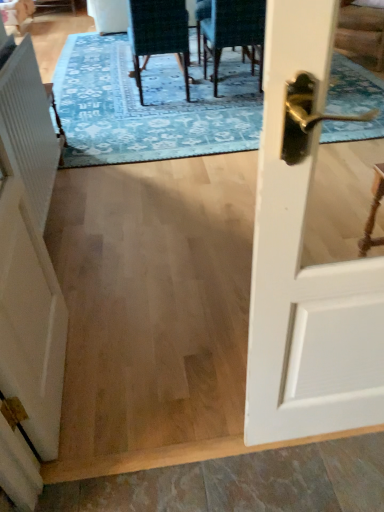
In order to click on velvet dark green chair at center, the 2th chair viewed from the right in this screenshot , I will do `click(159, 34)`.

Measure the distance between blue textured rug at center and camera.

8.70 feet.

This screenshot has width=384, height=512. Identify the location of velvet dark green chair at center, the 2th chair viewed from the right. (159, 34).

Can you tell me how much white ribbed radiator at left and velvet dark green chair at upper center, the 1th chair from the right, differ in facing direction?

The angular difference between white ribbed radiator at left and velvet dark green chair at upper center, the 1th chair from the right, is 87.5 degrees.

Between point (41, 215) and point (216, 82), which one is positioned in front?

The point (41, 215) is in front.

Do you think white ribbed radiator at left is within velvet dark green chair at upper center, the 2th chair when ordered from left to right, or outside of it?

The correct answer is: outside.

From a real-world perspective, between white ribbed radiator at left and velvet dark green chair at upper center, the 2th chair when ordered from left to right, who is vertically lower?

velvet dark green chair at upper center, the 2th chair when ordered from left to right, from a real-world perspective.

Is white ribbed radiator at left to the left or to the right of velvet dark green chair at center, marked as the first chair in a left-to-right arrangement, in the image?

From the image, it's evident that white ribbed radiator at left is to the left of velvet dark green chair at center, marked as the first chair in a left-to-right arrangement.

Which is in front, white ribbed radiator at left or velvet dark green chair at center, marked as the first chair in a left-to-right arrangement?

Positioned in front is white ribbed radiator at left.

From the image's perspective, which one is positioned higher, white ribbed radiator at left or velvet dark green chair at center, marked as the first chair in a left-to-right arrangement?

velvet dark green chair at center, marked as the first chair in a left-to-right arrangement, appears higher in the image.

Considering the relative sizes of blue textured rug at center and white matte barn door at left in the image provided, is blue textured rug at center shorter than white matte barn door at left?

Yes.

In terms of width, does blue textured rug at center look wider or thinner when compared to white matte barn door at left?

Clearly, blue textured rug at center has more width compared to white matte barn door at left.

Is blue textured rug at center bigger or smaller than white matte barn door at left?

Considering their sizes, blue textured rug at center takes up more space than white matte barn door at left.

Image resolution: width=384 pixels, height=512 pixels. In order to click on barn door that is above the blue textured rug at center (from a real-world perspective) in this screenshot , I will do `click(28, 282)`.

Considering the positions of point (25, 146) and point (167, 25), is point (25, 146) closer or farther from the camera than point (167, 25)?

Point (25, 146).

From the picture: Could you tell me if white matte barn door at left is turned towards velvet dark green chair at center, the 2th chair viewed from the right?

No, white matte barn door at left is not aimed at velvet dark green chair at center, the 2th chair viewed from the right.

Is white matte barn door at left beside velvet dark green chair at center, the 2th chair viewed from the right?

white matte barn door at left and velvet dark green chair at center, the 2th chair viewed from the right, are not in contact.

Does white matte barn door at left have a greater width compared to velvet dark green chair at center, marked as the first chair in a left-to-right arrangement?

No.

Can you confirm if white glossy door handle at right is wider than velvet dark green chair at upper center, the 2th chair when ordered from left to right?

No, white glossy door handle at right is not wider than velvet dark green chair at upper center, the 2th chair when ordered from left to right.

Is point (322, 73) positioned before point (253, 63)?

That is True.

Considering the sizes of objects white glossy door handle at right and velvet dark green chair at upper center, the 1th chair from the right, in the image provided, who is shorter, white glossy door handle at right or velvet dark green chair at upper center, the 1th chair from the right,?

With less height is velvet dark green chair at upper center, the 1th chair from the right.

Which is behind, white glossy door handle at right or velvet dark green chair at upper center, the 1th chair from the right?

velvet dark green chair at upper center, the 1th chair from the right.

Measure the distance between velvet dark green chair at center, marked as the first chair in a left-to-right arrangement, and white ribbed radiator at left.

A distance of 4.14 feet exists between velvet dark green chair at center, marked as the first chair in a left-to-right arrangement, and white ribbed radiator at left.

Is velvet dark green chair at center, the 2th chair viewed from the right, touching white ribbed radiator at left?

velvet dark green chair at center, the 2th chair viewed from the right, and white ribbed radiator at left are clearly separated.

I want to click on the 1st chair above the white ribbed radiator at left (from the image's perspective), so click(x=159, y=34).

Is the depth of velvet dark green chair at center, the 2th chair viewed from the right, less than that of white ribbed radiator at left?

No, it is not.

How many degrees apart are the facing directions of velvet dark green chair at upper center, the 1th chair from the right, and white matte barn door at left?

83.5 degrees.

From a real-world perspective, relative to white matte barn door at left, is velvet dark green chair at upper center, the 1th chair from the right, vertically above or below?

Clearly, from a real-world perspective, velvet dark green chair at upper center, the 1th chair from the right, is below white matte barn door at left.

Is velvet dark green chair at upper center, the 1th chair from the right, positioned far away from white matte barn door at left?

Yes, velvet dark green chair at upper center, the 1th chair from the right, is far from white matte barn door at left.

Does velvet dark green chair at upper center, the 2th chair when ordered from left to right, have a greater height compared to white matte barn door at left?

No.

The width and height of the screenshot is (384, 512). In order to click on radiator in front of the velvet dark green chair at upper center, the 2th chair when ordered from left to right in this screenshot , I will do `click(30, 128)`.

Locate an element on the screen. The image size is (384, 512). radiator below the velvet dark green chair at center, the 2th chair viewed from the right (from the image's perspective) is located at coordinates (30, 128).

Estimate the real-world distances between objects in this image. Which object is further from white ribbed radiator at left, velvet dark green chair at upper center, the 2th chair when ordered from left to right, or white matte barn door at left?

Among the two, velvet dark green chair at upper center, the 2th chair when ordered from left to right, is located further to white ribbed radiator at left.

Looking at the image, which one is located further to white matte barn door at left, velvet dark green chair at center, the 2th chair viewed from the right, or white ribbed radiator at left?

Based on the image, velvet dark green chair at center, the 2th chair viewed from the right, appears to be further to white matte barn door at left.

When comparing their distances from white glossy door handle at right, does white ribbed radiator at left or white matte barn door at left seem closer?

white matte barn door at left is positioned closer to the anchor white glossy door handle at right.

Considering their positions, is white glossy door handle at right positioned further to blue textured rug at center than white ribbed radiator at left?

Based on the image, white glossy door handle at right appears to be further to blue textured rug at center.

From the image, which object appears to be farther from white matte barn door at left, white ribbed radiator at left or velvet dark green chair at upper center, the 1th chair from the right?

The object further to white matte barn door at left is velvet dark green chair at upper center, the 1th chair from the right.

Looking at this image, when comparing their distances from white matte barn door at left, does blue textured rug at center or velvet dark green chair at upper center, the 2th chair when ordered from left to right, seem further?

velvet dark green chair at upper center, the 2th chair when ordered from left to right.

Considering their positions, is velvet dark green chair at center, the 2th chair viewed from the right, positioned further to velvet dark green chair at upper center, the 1th chair from the right, than white matte barn door at left?

white matte barn door at left.

Based on their spatial positions, is white matte barn door at left or white glossy door handle at right further from white ribbed radiator at left?

white glossy door handle at right is positioned further to the anchor white ribbed radiator at left.

In order to click on radiator between white glossy door handle at right and velvet dark green chair at center, the 2th chair viewed from the right, from front to back in this screenshot , I will do `click(30, 128)`.

Where is `mat between white matte barn door at left and velvet dark green chair at center, marked as the first chair in a left-to-right arrangement, from front to back`? mat between white matte barn door at left and velvet dark green chair at center, marked as the first chair in a left-to-right arrangement, from front to back is located at coordinates (150, 105).

This screenshot has height=512, width=384. I want to click on chair between white glossy door handle at right and velvet dark green chair at upper center, the 2th chair when ordered from left to right, along the z-axis, so click(x=159, y=34).

Identify the location of radiator positioned between white glossy door handle at right and blue textured rug at center from near to far. The height and width of the screenshot is (512, 384). (30, 128).